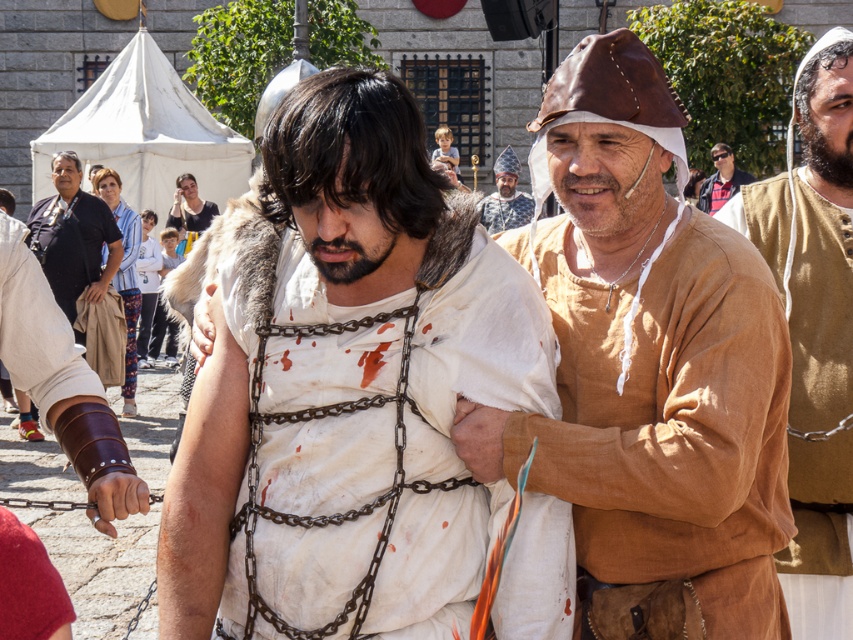
Question: Which of the following is the closest to the observer?

Choices:
 (A) matte black hair at upper center
 (B) brown leather hat at upper center
 (C) light brown leather hat at upper center
 (D) white clothed man at center

Answer: (B)

Question: Does dark brown leather jacket at center appear over red fabric cap at lower left?

Choices:
 (A) yes
 (B) no

Answer: (A)

Question: Which object appears farthest from the camera in this image?

Choices:
 (A) light blue striped shirt at center
 (B) red fabric cap at lower left
 (C) light brown leather hat at upper center

Answer: (C)

Question: Does light blue striped shirt at center appear on the right side of white cotton shirt at center?

Choices:
 (A) yes
 (B) no

Answer: (A)

Question: Is white cotton shirt at center closer to the viewer compared to matte black hair at upper center?

Choices:
 (A) no
 (B) yes

Answer: (B)

Question: Among these points, which one is nearest to the camera?

Choices:
 (A) (209, 272)
 (B) (712, 157)
 (C) (838, 456)

Answer: (C)